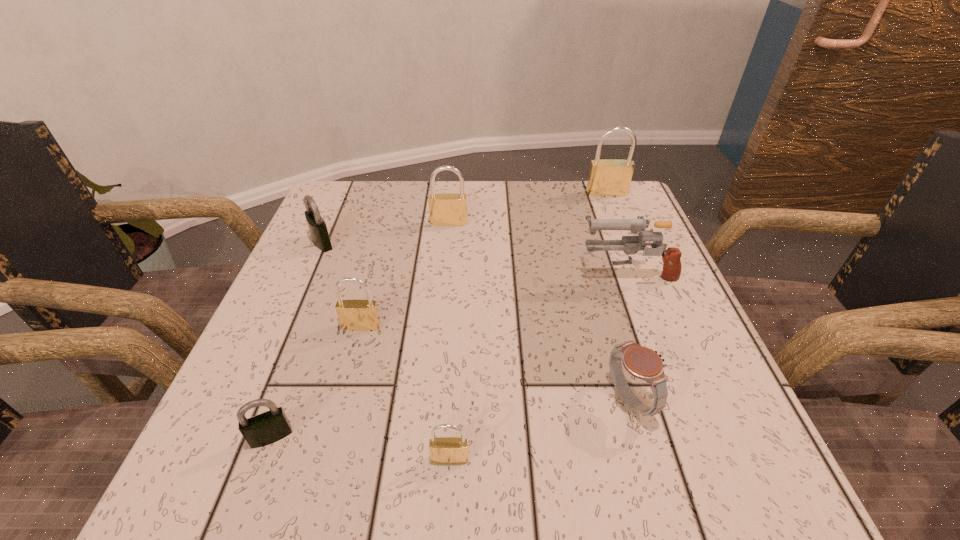
Identify the location of blank space located on the front-facing side of the second nearest brass padlock. 335,427.

In order to click on free space located on the front of the watch in this screenshot , I will do `click(657, 494)`.

I want to click on vacant space located 0.190m on the back of the nearer black padlock, so click(312, 329).

The width and height of the screenshot is (960, 540). Identify the location of padlock that is at the right edge. (611, 177).

You are a GUI agent. You are given a task and a screenshot of the screen. Output one action in this format:
    pyautogui.click(x=<x>, y=<y>)
    Task: Click on the gun that is at the right edge
    The height and width of the screenshot is (540, 960).
    Given the screenshot: What is the action you would take?
    pyautogui.click(x=671, y=272)

Where is `watch present at the right edge`? The height and width of the screenshot is (540, 960). watch present at the right edge is located at coordinates (641, 362).

At what (x,y) coordinates should I click in order to perform the action: click on object that is at the far left corner. Please return your answer as a coordinate pair (x, y). This screenshot has height=540, width=960. Looking at the image, I should click on (317, 226).

Find the location of a particular element. The image size is (960, 540). object that is at the near left corner is located at coordinates (266, 428).

I want to click on object present at the far right corner, so click(611, 177).

Locate an element on the screen. Image resolution: width=960 pixels, height=540 pixels. vacant region at the far edge of the desktop is located at coordinates (517, 201).